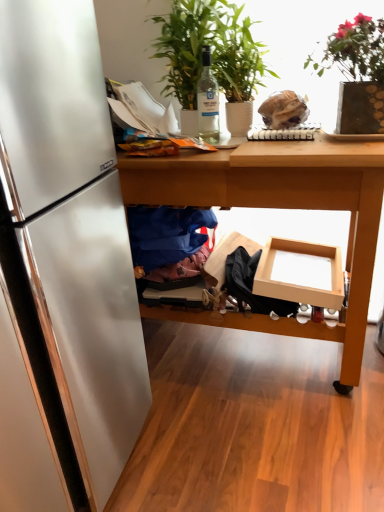
Measure the distance between green leafy plant at upper center, placed as the first houseplant when sorted from left to right, and camera.

A distance of 1.41 meters exists between green leafy plant at upper center, placed as the first houseplant when sorted from left to right, and camera.

Find the location of a particular element. Image resolution: width=384 pixels, height=512 pixels. matte cardboard box at center is located at coordinates (300, 273).

At what (x,y) coordinates should I click in order to perform the action: click on blue fabric at lower center. Please return your answer as a coordinate pair (x, y). This screenshot has height=512, width=384. Looking at the image, I should click on (166, 234).

The width and height of the screenshot is (384, 512). In order to click on wooden table at center in this screenshot , I will do `click(279, 207)`.

Is wooden table at center not close to clear glass bottle at center?

No.

In the scene shown: Is wooden table at center facing towards clear glass bottle at center?

No, wooden table at center does not turn towards clear glass bottle at center.

Between point (290, 197) and point (202, 70), which one is positioned behind?

The point (202, 70) is behind.

In terms of size, does wooden table at center appear bigger or smaller than clear glass bottle at center?

In the image, wooden table at center appears to be larger than clear glass bottle at center.

From a real-world perspective, which object rests below the other?

blue fabric at lower center.

Which object is wider, green leafy plant at upper center, the second houseplant positioned from the right, or blue fabric at lower center?

With larger width is green leafy plant at upper center, the second houseplant positioned from the right.

Can you confirm if green leafy plant at upper center, placed as the first houseplant when sorted from left to right, is positioned to the right of blue fabric at lower center?

Yes, green leafy plant at upper center, placed as the first houseplant when sorted from left to right, is to the right of blue fabric at lower center.

Is green leafy plant at upper center, placed as the first houseplant when sorted from left to right, next to blue fabric at lower center?

No, green leafy plant at upper center, placed as the first houseplant when sorted from left to right, is not with blue fabric at lower center.

In the scene shown: Which is nearer, (306, 174) or (229, 87)?

The point (306, 174) is in front.

What's the angular difference between wooden table at center and green leafy plant at upper center, placed as the first houseplant when sorted from left to right,'s facing directions?

There is a 1.15-degree angle between the facing directions of wooden table at center and green leafy plant at upper center, placed as the first houseplant when sorted from left to right.

From the image's perspective, which object appears higher, wooden table at center or green leafy plant at upper center, the second houseplant positioned from the right?

green leafy plant at upper center, the second houseplant positioned from the right.

From the picture: Considering the sizes of wooden table at center and green leafy plant at upper center, placed as the first houseplant when sorted from left to right, in the image, is wooden table at center wider or thinner than green leafy plant at upper center, placed as the first houseplant when sorted from left to right,?

Clearly, wooden table at center has more width compared to green leafy plant at upper center, placed as the first houseplant when sorted from left to right.

Is clear glass bottle at center bigger than green leafy plant at upper right, positioned as the second houseplant in left-to-right order?

No, clear glass bottle at center is not bigger than green leafy plant at upper right, positioned as the second houseplant in left-to-right order.

Is clear glass bottle at center not near green leafy plant at upper right, positioned as the second houseplant in left-to-right order?

They are positioned close to each other.

Looking at this image, can you confirm if clear glass bottle at center is thinner than green leafy plant at upper right, which is the 1th houseplant from right to left?

Yes, clear glass bottle at center is thinner than green leafy plant at upper right, which is the 1th houseplant from right to left.

Consider the image. Is clear glass bottle at center facing towards green leafy plant at upper right, which is the 1th houseplant from right to left?

No, clear glass bottle at center is not facing towards green leafy plant at upper right, which is the 1th houseplant from right to left.

Which object is closer to the camera, green leafy plant at upper right, positioned as the second houseplant in left-to-right order, or clear glass bottle at center?

Positioned in front is green leafy plant at upper right, positioned as the second houseplant in left-to-right order.

Looking at this image, is green leafy plant at upper right, which is the 1th houseplant from right to left, wider or thinner than clear glass bottle at center?

green leafy plant at upper right, which is the 1th houseplant from right to left, is wider than clear glass bottle at center.

From a real-world perspective, is green leafy plant at upper right, which is the 1th houseplant from right to left, under clear glass bottle at center?

Incorrect, from a real-world perspective, green leafy plant at upper right, which is the 1th houseplant from right to left, is higher than clear glass bottle at center.

Is green leafy plant at upper right, which is the 1th houseplant from right to left, taller or shorter than clear glass bottle at center?

In the image, green leafy plant at upper right, which is the 1th houseplant from right to left, appears to be taller than clear glass bottle at center.

Is matte cardboard box at center wider or thinner than blue fabric at lower center?

Considering their sizes, matte cardboard box at center looks broader than blue fabric at lower center.

Is matte cardboard box at center oriented towards blue fabric at lower center?

No, matte cardboard box at center does not turn towards blue fabric at lower center.

Which is in front, matte cardboard box at center or blue fabric at lower center?

Positioned in front is matte cardboard box at center.

From a real-world perspective, is matte cardboard box at center positioned over blue fabric at lower center based on gravity?

No, from a real-world perspective, matte cardboard box at center is not over blue fabric at lower center

From the image's perspective, is wooden table at center above or below matte cardboard box at center?

Based on their image positions, wooden table at center is located above matte cardboard box at center.

Between wooden table at center and matte cardboard box at center, which one appears on the left side from the viewer's perspective?

wooden table at center is more to the left.

Image resolution: width=384 pixels, height=512 pixels. I want to click on table that is above the matte cardboard box at center (from a real-world perspective), so [279, 207].

Identify the location of bottle behind the wooden table at center. (208, 101).

Identify the location of clothing that is on the left side of green leafy plant at upper center, the second houseplant positioned from the right. pos(166,234).

From the image, which object appears to be farther from green leafy plant at upper center, placed as the first houseplant when sorted from left to right, wooden table at center or matte cardboard box at center?

matte cardboard box at center.

Looking at the image, which one is located closer to wooden table at center, matte cardboard box at center or clear glass bottle at center?

The object closer to wooden table at center is matte cardboard box at center.

Considering their positions, is clear glass bottle at center positioned closer to matte cardboard box at center than blue fabric at lower center?

blue fabric at lower center is closer to matte cardboard box at center.

Based on their spatial positions, is green leafy plant at upper right, which is the 1th houseplant from right to left, or blue fabric at lower center closer to green leafy plant at upper center, placed as the first houseplant when sorted from left to right?

green leafy plant at upper right, which is the 1th houseplant from right to left, is closer to green leafy plant at upper center, placed as the first houseplant when sorted from left to right.

Which object lies further to the anchor point matte cardboard box at center, green leafy plant at upper right, positioned as the second houseplant in left-to-right order, or blue fabric at lower center?

green leafy plant at upper right, positioned as the second houseplant in left-to-right order.

When comparing their distances from green leafy plant at upper right, positioned as the second houseplant in left-to-right order, does wooden table at center or blue fabric at lower center seem further?

Based on the image, blue fabric at lower center appears to be further to green leafy plant at upper right, positioned as the second houseplant in left-to-right order.

Consider the image. Which object lies further to the anchor point green leafy plant at upper right, which is the 1th houseplant from right to left, green leafy plant at upper center, placed as the first houseplant when sorted from left to right, or matte cardboard box at center?

matte cardboard box at center.

Consider the image. From the image, which object appears to be nearer to matte cardboard box at center, clear glass bottle at center or green leafy plant at upper right, which is the 1th houseplant from right to left?

The object closer to matte cardboard box at center is green leafy plant at upper right, which is the 1th houseplant from right to left.

Where is `table between green leafy plant at upper right, positioned as the second houseplant in left-to-right order, and matte cardboard box at center from top to bottom`? The width and height of the screenshot is (384, 512). table between green leafy plant at upper right, positioned as the second houseplant in left-to-right order, and matte cardboard box at center from top to bottom is located at coordinates (279, 207).

Locate an element on the screen. The height and width of the screenshot is (512, 384). clothing between clear glass bottle at center and wooden table at center in the up-down direction is located at coordinates (166, 234).

Where is `bottle between green leafy plant at upper right, positioned as the second houseplant in left-to-right order, and matte cardboard box at center vertically`? Image resolution: width=384 pixels, height=512 pixels. bottle between green leafy plant at upper right, positioned as the second houseplant in left-to-right order, and matte cardboard box at center vertically is located at coordinates (208, 101).

This screenshot has height=512, width=384. Find the location of `table between blue fabric at lower center and matte cardboard box at center in the horizontal direction`. table between blue fabric at lower center and matte cardboard box at center in the horizontal direction is located at coordinates (279, 207).